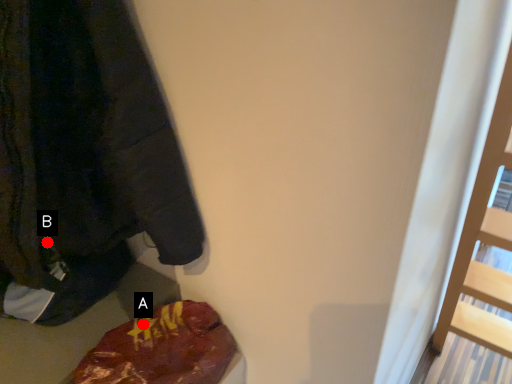
Question: Two points are circled on the image, labeled by A and B beside each circle. Which point is closer to the camera taking this photo?

Choices:
 (A) A is closer
 (B) B is closer

Answer: (B)